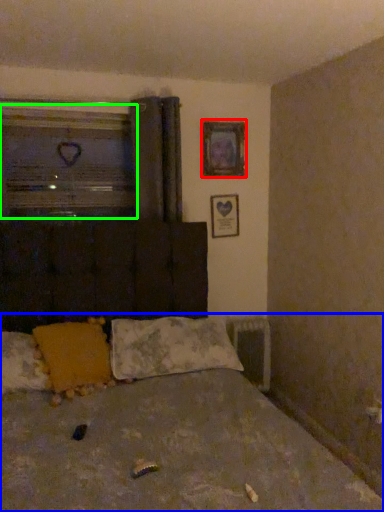
Question: Which object is the closest to the picture frame (highlighted by a red box)? Choose among these: bed (highlighted by a blue box) or window (highlighted by a green box).

Choices:
 (A) bed
 (B) window

Answer: (B)